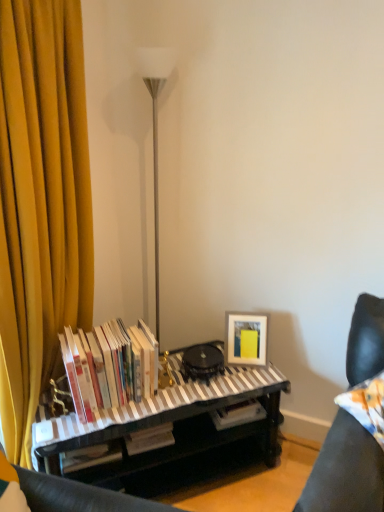
Question: Is leather couch cushion at lower right in front of striped fabric piano at center?

Choices:
 (A) no
 (B) yes

Answer: (B)

Question: Is leather couch cushion at lower right wider than striped fabric piano at center?

Choices:
 (A) no
 (B) yes

Answer: (A)

Question: From a real-world perspective, is leather couch cushion at lower right positioned over striped fabric piano at center based on gravity?

Choices:
 (A) no
 (B) yes

Answer: (B)

Question: Is leather couch cushion at lower right at the left side of striped fabric piano at center?

Choices:
 (A) no
 (B) yes

Answer: (A)

Question: Is leather couch cushion at lower right not inside striped fabric piano at center?

Choices:
 (A) no
 (B) yes

Answer: (B)

Question: Is leather couch cushion at lower right beside striped fabric piano at center?

Choices:
 (A) yes
 (B) no

Answer: (B)

Question: Considering the relative positions of yellow fabric curtain at left and leather couch cushion at lower right in the image provided, is yellow fabric curtain at left to the left of leather couch cushion at lower right from the viewer's perspective?

Choices:
 (A) no
 (B) yes

Answer: (B)

Question: Is yellow fabric curtain at left closer to camera compared to leather couch cushion at lower right?

Choices:
 (A) yes
 (B) no

Answer: (A)

Question: From the image's perspective, is yellow fabric curtain at left located beneath leather couch cushion at lower right?

Choices:
 (A) no
 (B) yes

Answer: (A)

Question: From a real-world perspective, does yellow fabric curtain at left sit lower than leather couch cushion at lower right?

Choices:
 (A) no
 (B) yes

Answer: (A)

Question: Is yellow fabric curtain at left aimed at leather couch cushion at lower right?

Choices:
 (A) yes
 (B) no

Answer: (A)

Question: Does yellow fabric curtain at left come behind leather couch cushion at lower right?

Choices:
 (A) no
 (B) yes

Answer: (A)

Question: Is striped fabric piano at center wider than leather couch cushion at lower right?

Choices:
 (A) yes
 (B) no

Answer: (A)